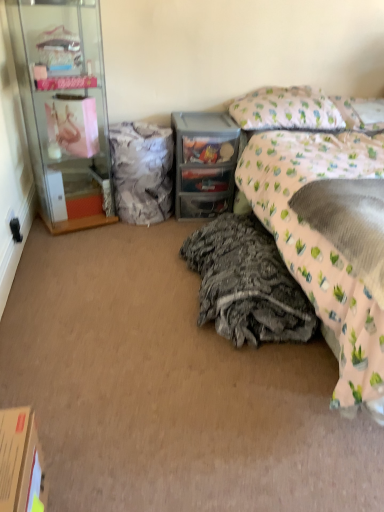
At what (x,y) coordinates should I click in order to perform the action: click on vacant area that is in front of clear glass cabinet at left. Please return your answer as a coordinate pair (x, y). The width and height of the screenshot is (384, 512). Looking at the image, I should click on (57, 252).